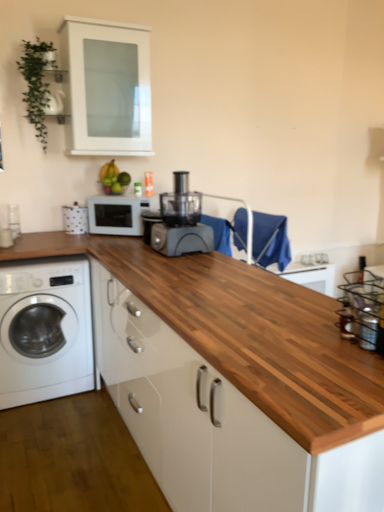
Locate an element on the screen. free space in front of clear glass bottle at right is located at coordinates (343, 366).